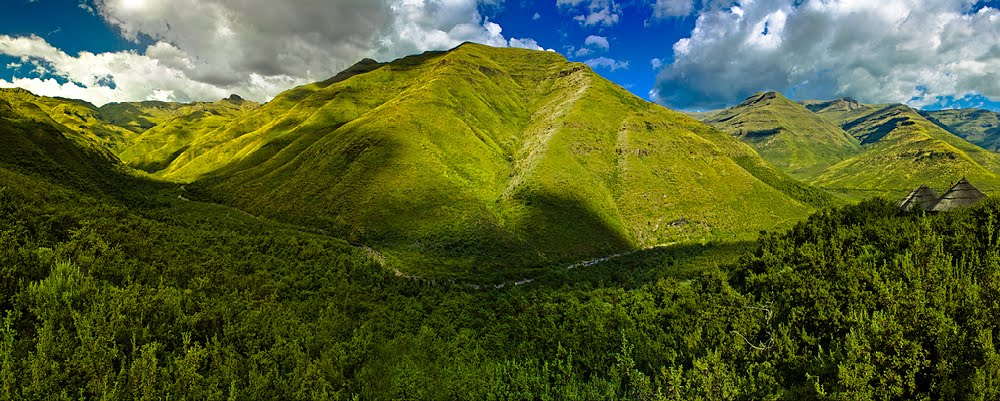
Find the location of `picture`. picture is located at coordinates (823, 300).